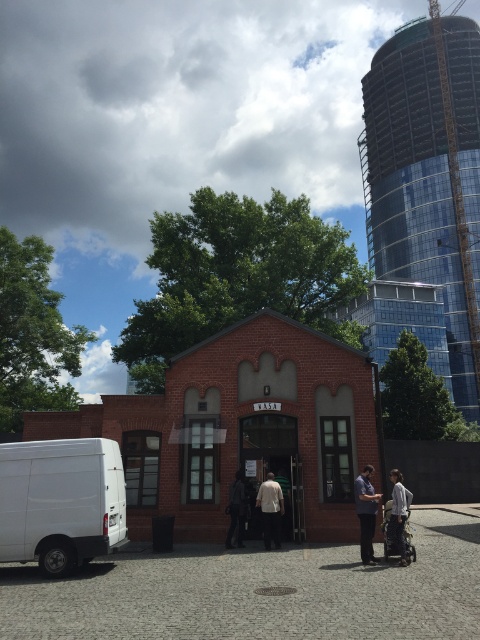
Does blue cotton shirt at center have a smaller size compared to light gray fabric jacket at center?

No.

Is point (370, 467) positioned after point (398, 508)?

Yes, point (370, 467) is farther from viewer.

Which is behind, point (369, 547) or point (399, 477)?

The point (399, 477) is more distant.

Identify the location of blue cotton shirt at center. (365, 513).

Does glassy steel tower at upper right lie behind light beige fabric shirt at center?

Yes, it is.

Is point (402, 92) closer to viewer compared to point (272, 515)?

No, it is not.

The height and width of the screenshot is (640, 480). What are the coordinates of `glassy steel tower at upper right` in the screenshot? It's located at (428, 177).

Does white matte van at lower left appear over light beige fabric shirt at center?

Indeed, white matte van at lower left is positioned over light beige fabric shirt at center.

Does white matte van at lower left come in front of light beige fabric shirt at center?

Yes, white matte van at lower left is closer to the viewer.

Which is in front, point (26, 456) or point (269, 531)?

Point (26, 456)

Where is `white matte van at lower left`? white matte van at lower left is located at coordinates (60, 500).